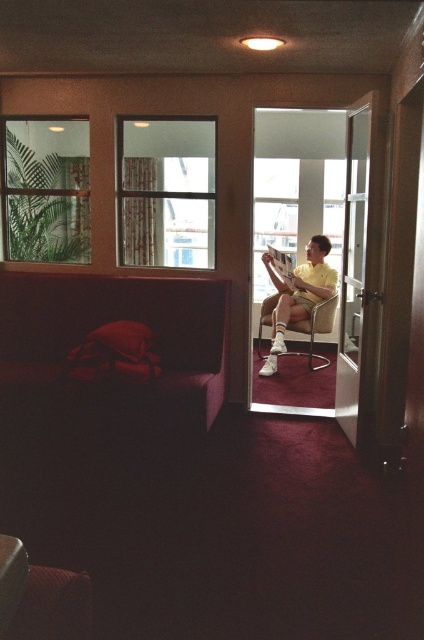
Question: Which of these objects is positioned closest to the yellow matte shirt at center?

Choices:
 (A) clear glass window at upper center
 (B) velvet red couch at lower left
 (C) hardcover book at center

Answer: (C)

Question: Considering the real-world distances, which object is farthest from the clear glass window at upper center?

Choices:
 (A) velvet red couch at lower left
 (B) green leafy plant at left

Answer: (A)

Question: Does clear glass window at upper center come in front of hardcover book at center?

Choices:
 (A) yes
 (B) no

Answer: (A)

Question: Which point is farther to the camera?

Choices:
 (A) clear glass window at upper center
 (B) green leafy plant at left

Answer: (B)

Question: In this image, where is velvet red couch at lower left located relative to hardcover book at center?

Choices:
 (A) right
 (B) left

Answer: (B)

Question: Is green leafy plant at left smaller than yellow matte shirt at center?

Choices:
 (A) yes
 (B) no

Answer: (A)